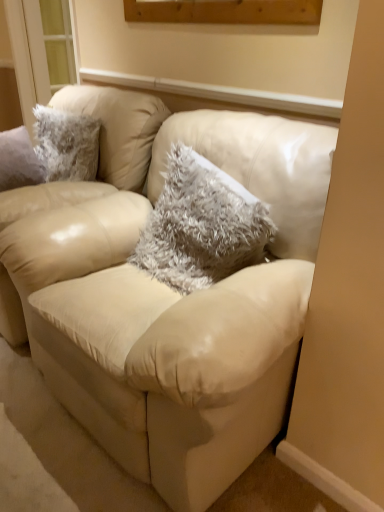
Question: Is beige leather couch at center bigger than fuzzy gray pillow at center?

Choices:
 (A) no
 (B) yes

Answer: (B)

Question: From a real-world perspective, is beige leather couch at center physically above fuzzy gray pillow at center?

Choices:
 (A) yes
 (B) no

Answer: (B)

Question: Is beige leather couch at center shorter than fuzzy gray pillow at center?

Choices:
 (A) no
 (B) yes

Answer: (A)

Question: Can you confirm if beige leather couch at center is taller than fuzzy gray pillow at center?

Choices:
 (A) yes
 (B) no

Answer: (A)

Question: Would you consider beige leather couch at center to be distant from fuzzy gray pillow at center?

Choices:
 (A) yes
 (B) no

Answer: (B)

Question: From a real-world perspective, relative to fuzzy gray pillow at center, is beige leather chair at center vertically above or below?

Choices:
 (A) above
 (B) below

Answer: (B)

Question: Looking at their shapes, would you say beige leather chair at center is wider or thinner than fuzzy gray pillow at center?

Choices:
 (A) thin
 (B) wide

Answer: (B)

Question: Relative to fuzzy gray pillow at center, is beige leather chair at center in front or behind?

Choices:
 (A) front
 (B) behind

Answer: (B)

Question: Do you think beige leather chair at center is within fuzzy gray pillow at center, or outside of it?

Choices:
 (A) outside
 (B) inside

Answer: (A)

Question: From a real-world perspective, is beige leather chair at center positioned above or below beige leather couch at center?

Choices:
 (A) above
 (B) below

Answer: (A)

Question: Looking at the image, does beige leather chair at center seem bigger or smaller compared to beige leather couch at center?

Choices:
 (A) small
 (B) big

Answer: (B)

Question: Choose the correct answer: Is beige leather chair at center inside beige leather couch at center or outside it?

Choices:
 (A) outside
 (B) inside

Answer: (A)

Question: Considering the positions of beige leather chair at center and beige leather couch at center in the image, is beige leather chair at center wider or thinner than beige leather couch at center?

Choices:
 (A) thin
 (B) wide

Answer: (B)

Question: In the image, is fuzzy gray pillow at center positioned in front of or behind beige leather chair at center?

Choices:
 (A) front
 (B) behind

Answer: (A)

Question: From the image's perspective, is fuzzy gray pillow at center positioned above or below beige leather chair at center?

Choices:
 (A) below
 (B) above

Answer: (A)